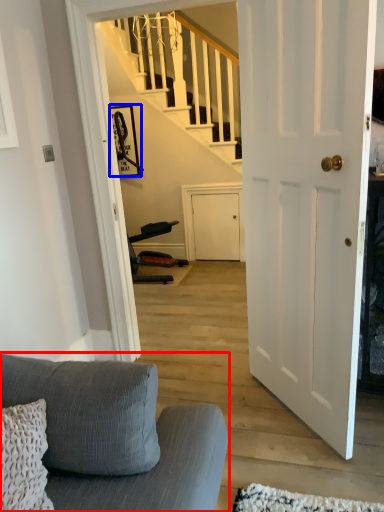
Question: Among these objects, which one is farthest to the camera, studio couch (highlighted by a red box) or picture frame (highlighted by a blue box)?

Choices:
 (A) studio couch
 (B) picture frame

Answer: (B)